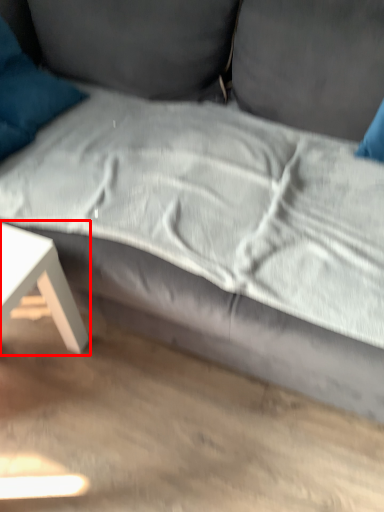
Question: From the image's perspective, what is the correct spatial positioning of table (annotated by the red box) in reference to pillow?

Choices:
 (A) above
 (B) below

Answer: (B)